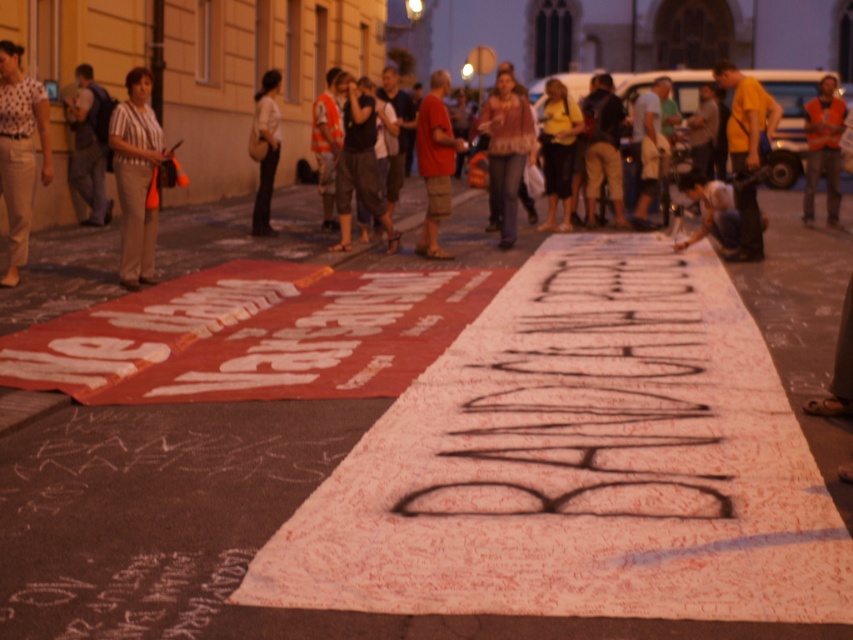
Does khaki cotton shorts at center have a lesser width compared to dark blue jeans at lower right?

Indeed, khaki cotton shorts at center has a lesser width compared to dark blue jeans at lower right.

Which is more to the right, khaki cotton shorts at center or dark blue jeans at lower right?

Positioned to the right is dark blue jeans at lower right.

Is point (621, 216) closer to viewer compared to point (717, 192)?

No, (621, 216) is further to viewer.

Where is `khaki cotton shorts at center`? khaki cotton shorts at center is located at coordinates (602, 148).

Is striped fabric shirt at left to the right of orange reflective vest at right from the viewer's perspective?

No, striped fabric shirt at left is not to the right of orange reflective vest at right.

Does striped fabric shirt at left have a smaller size compared to orange reflective vest at right?

Incorrect, striped fabric shirt at left is not smaller in size than orange reflective vest at right.

Who is more distant from viewer, (122, 144) or (839, 132)?

The point (839, 132) is behind.

Locate an element on the screen. striped fabric shirt at left is located at coordinates (135, 177).

Can you confirm if white paper at center is bigger than striped fabric shirt at left?

Yes.

Who is shorter, white paper at center or striped fabric shirt at left?

Standing shorter between the two is white paper at center.

Identify the location of white paper at center. pos(212,529).